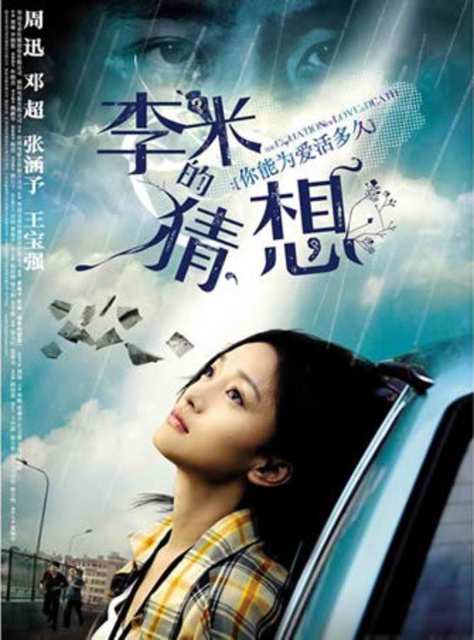
Is yellow plaid shirt at center behind transparent glass car window at lower right?

That is True.

Between point (140, 580) and point (445, 428), which one is positioned behind?

The point (140, 580) is more distant.

Is point (373, 387) closer to camera compared to point (392, 618)?

No, (373, 387) is further to viewer.

This screenshot has width=474, height=640. Identify the location of yellow plaid shirt at center. (242, 486).